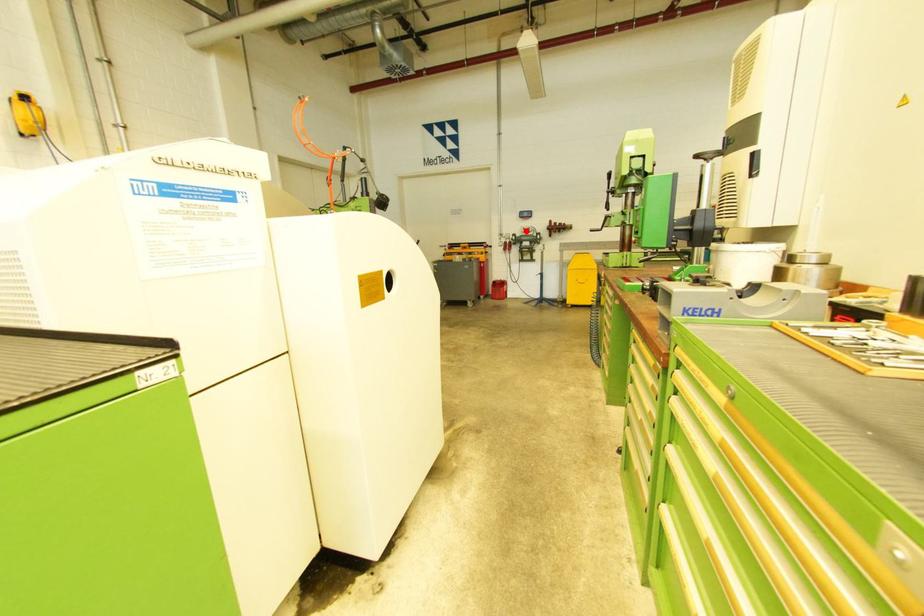
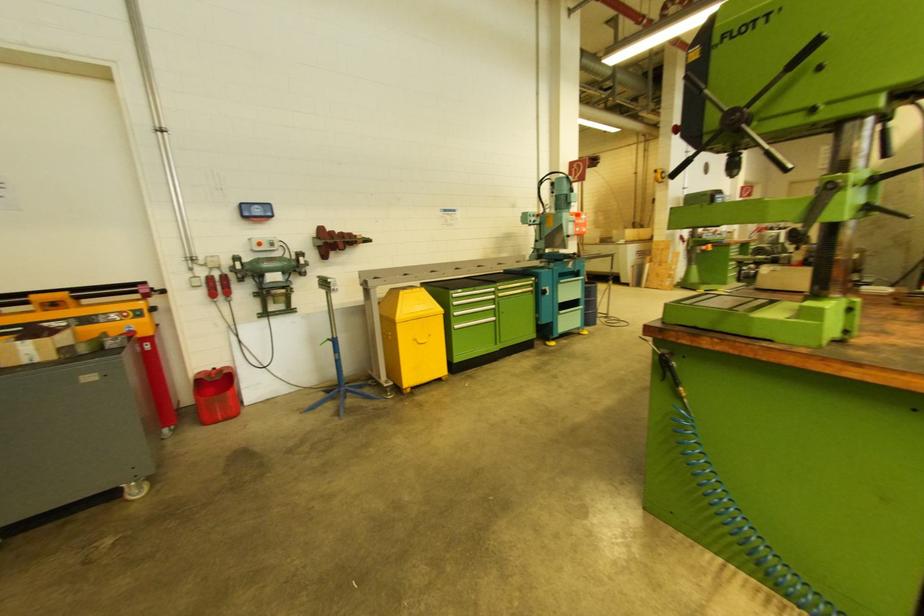
Question: A red point is marked in image1. In image2, is the corresponding 3D point closer to the camera or farther? Reply with the corresponding letter.

Choices:
 (A) The corresponding 3D point is closer.
 (B) The corresponding 3D point is farther.

Answer: (B)